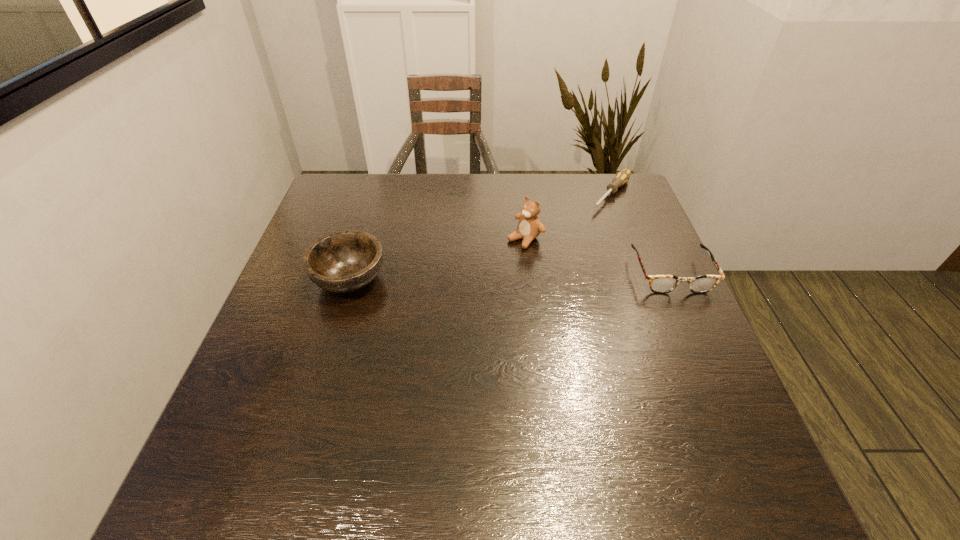
You are a GUI agent. You are given a task and a screenshot of the screen. Output one action in this format:
    pyautogui.click(x=<x>, y=<y>)
    Task: Click on the vacant space on the desktop that is between the bowl and the spectacles and is positioned at the tip of the farthest object
    Image resolution: width=960 pixels, height=540 pixels.
    Given the screenshot: What is the action you would take?
    pyautogui.click(x=536, y=276)

At what (x,y) coordinates should I click in order to perform the action: click on vacant space on the desktop that is between the bowl and the second shortest object and is positioned on the front-facing side of the tallest object. Please return your answer as a coordinate pair (x, y). This screenshot has width=960, height=540. Looking at the image, I should click on (475, 277).